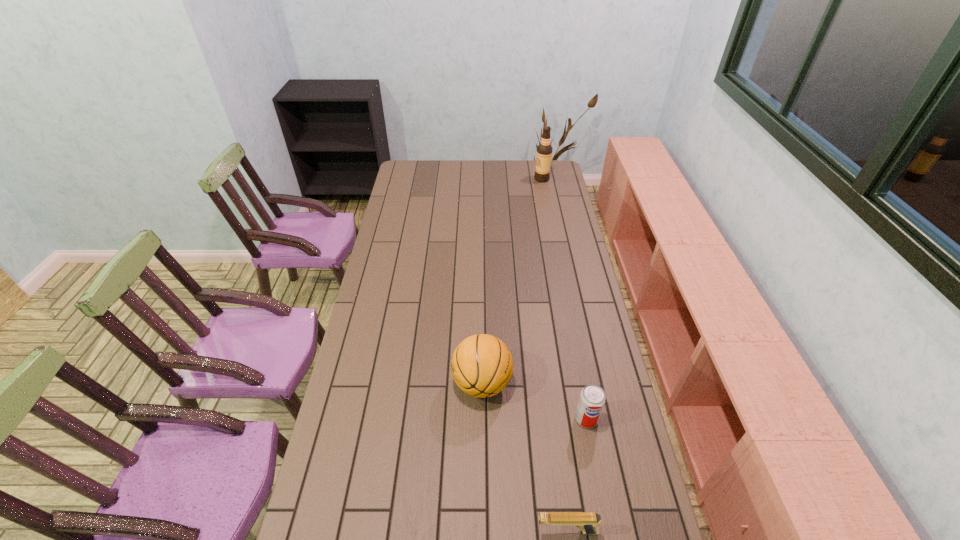
Identify the location of vacant area that lies between the soda and the nearest object. The width and height of the screenshot is (960, 540). (577, 475).

Where is `free space between the soda and the basketball`? free space between the soda and the basketball is located at coordinates (535, 401).

Image resolution: width=960 pixels, height=540 pixels. In order to click on vacant space that is in between the farthest object and the third tallest object in this screenshot , I will do `click(564, 299)`.

Where is `free space between the farthest object and the pistol`? The image size is (960, 540). free space between the farthest object and the pistol is located at coordinates (554, 355).

The height and width of the screenshot is (540, 960). I want to click on free spot between the nearest object and the third tallest object, so click(577, 475).

This screenshot has height=540, width=960. Find the location of `object that can be found as the closest to the second shortest object`. object that can be found as the closest to the second shortest object is located at coordinates (482, 366).

Identify which object is located as the nearest to the shortest object. Please provide its 2D coordinates. Your answer should be formatted as a tuple, i.e. [(x, y)], where the tuple contains the x and y coordinates of a point satisfying the conditions above.

[(592, 399)]

At what (x,y) coordinates should I click in order to perform the action: click on vacant region that satisfies the following two spatial constraints: 1. on the back side of the soda; 2. on the surface of the leftmost object near the brand logo. Please return your answer as a coordinate pair (x, y). Image resolution: width=960 pixels, height=540 pixels. Looking at the image, I should click on (580, 383).

Where is `free space that satisfies the following two spatial constraints: 1. on the surface of the basketball near the brand logo; 2. on the back side of the second shortest object`? The height and width of the screenshot is (540, 960). free space that satisfies the following two spatial constraints: 1. on the surface of the basketball near the brand logo; 2. on the back side of the second shortest object is located at coordinates (482, 418).

At what (x,y) coordinates should I click in order to perform the action: click on vacant region that satisfies the following two spatial constraints: 1. on the surface of the soda near the brand logo; 2. on the right side of the leftmost object. Please return your answer as a coordinate pair (x, y). Looking at the image, I should click on (482, 418).